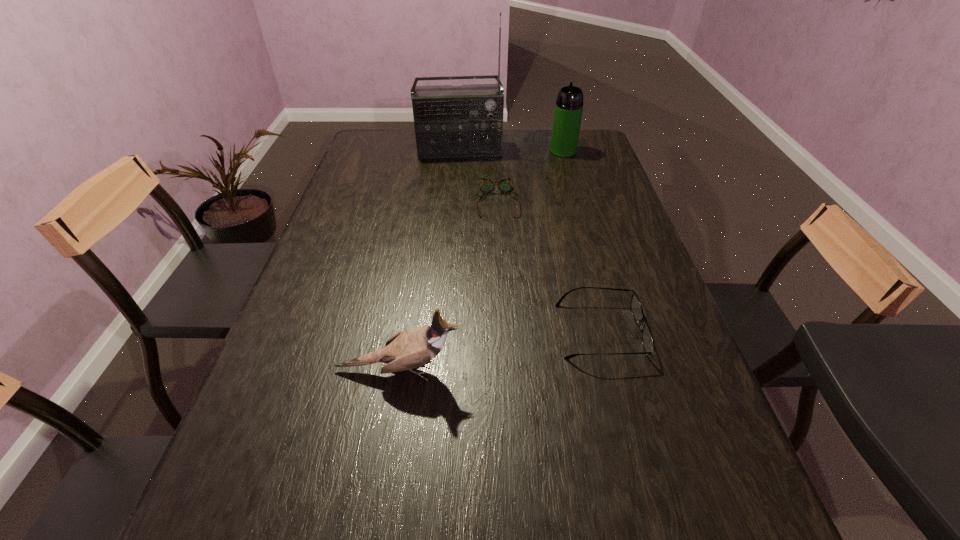
Image resolution: width=960 pixels, height=540 pixels. I want to click on spectacles that is positioned at the right edge, so (x=636, y=308).

In order to click on thermos bottle at the right edge in this screenshot , I will do `click(569, 105)`.

The height and width of the screenshot is (540, 960). What are the coordinates of `object that is at the far right corner` in the screenshot? It's located at (569, 105).

Identify the location of vacant area at the far edge of the desktop. (530, 153).

Locate an element on the screen. This screenshot has height=540, width=960. vacant space at the near edge of the desktop is located at coordinates (505, 489).

This screenshot has width=960, height=540. I want to click on vacant space at the left edge, so click(387, 190).

The image size is (960, 540). In the image, there is a desktop. What are the coordinates of `vacant region at the right edge` in the screenshot? It's located at tap(653, 327).

Where is `vacant space at the far left corner`? Image resolution: width=960 pixels, height=540 pixels. vacant space at the far left corner is located at coordinates (399, 132).

At what (x,y) coordinates should I click in order to perform the action: click on vacant space at the far right corner of the desktop. Please return your answer as a coordinate pair (x, y). This screenshot has height=540, width=960. Looking at the image, I should click on (595, 142).

Where is `unoccupied area between the bird and the tallest object`? unoccupied area between the bird and the tallest object is located at coordinates [x=429, y=260].